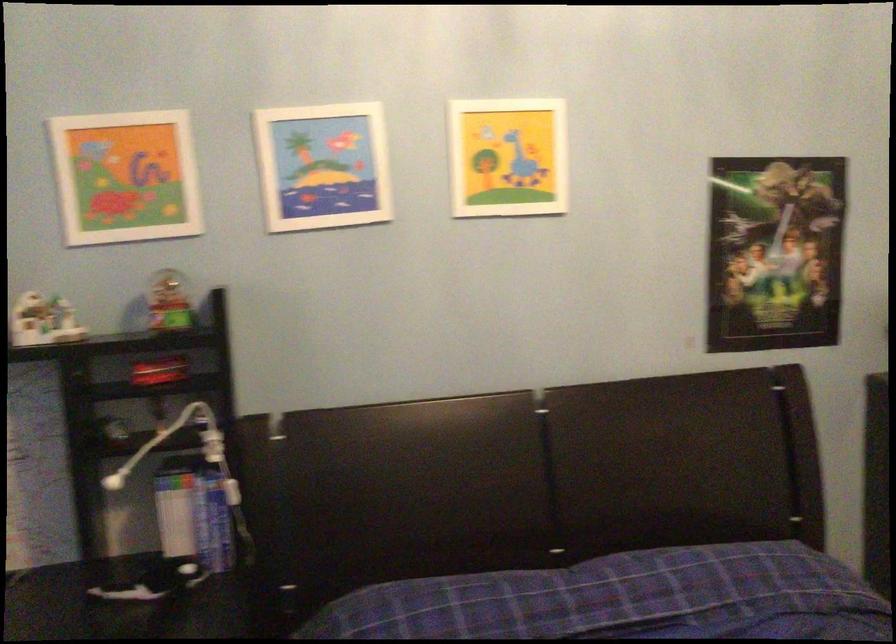
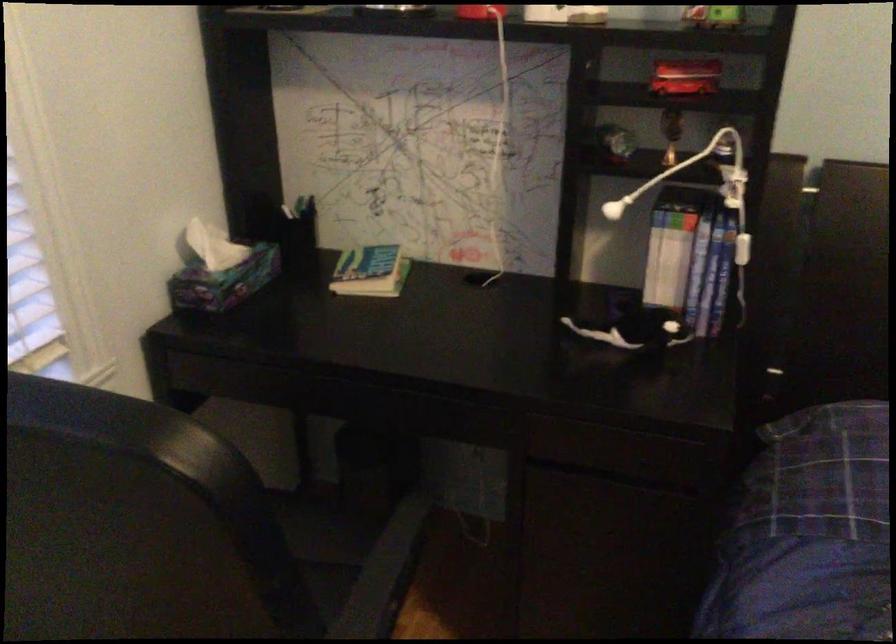
In the second image, find the point that corresponds to pixel 168 323 in the first image.

(713, 17)